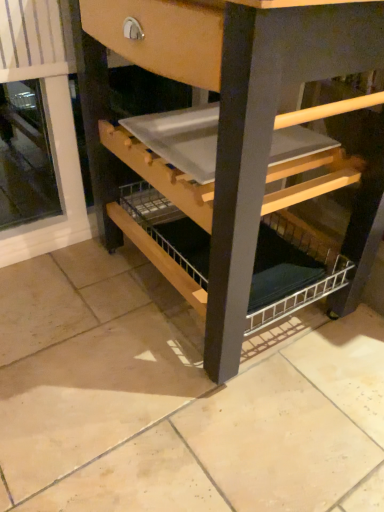
Identify the location of free space to the left of wooden tray at center. (62, 307).